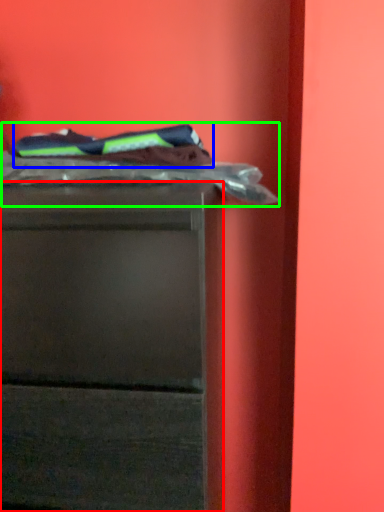
Question: Based on their relative distances, which object is farther from chest of drawers (highlighted by a red box)? Choose from laundry (highlighted by a blue box) and laundry (highlighted by a green box).

Choices:
 (A) laundry
 (B) laundry

Answer: (A)